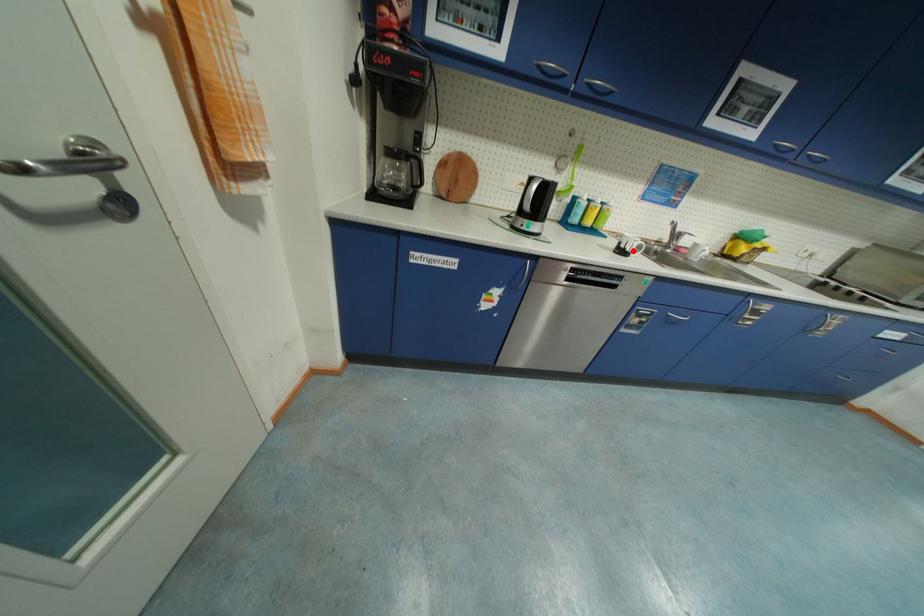
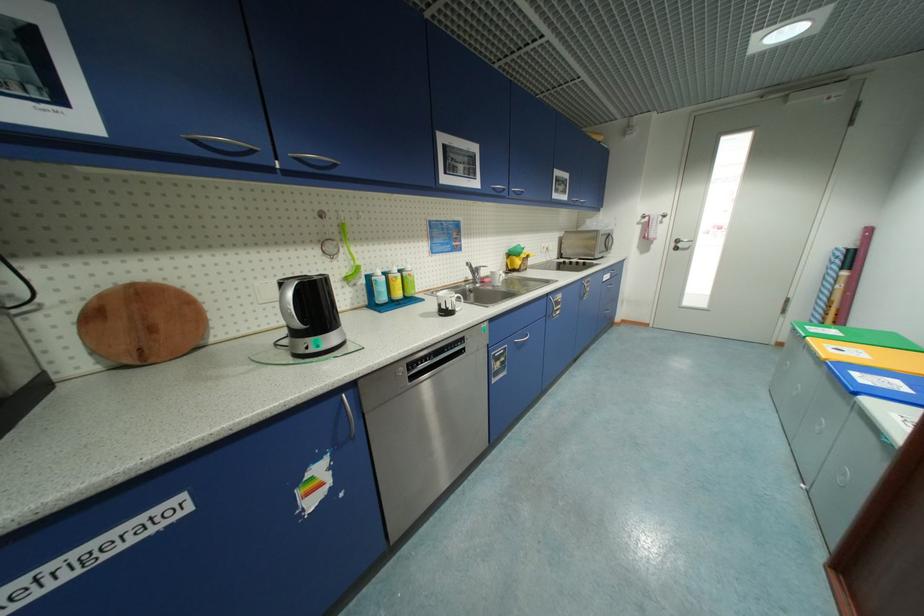
The point at the highlighted location is marked in the first image. Where is the corresponding point in the second image?

(456, 310)